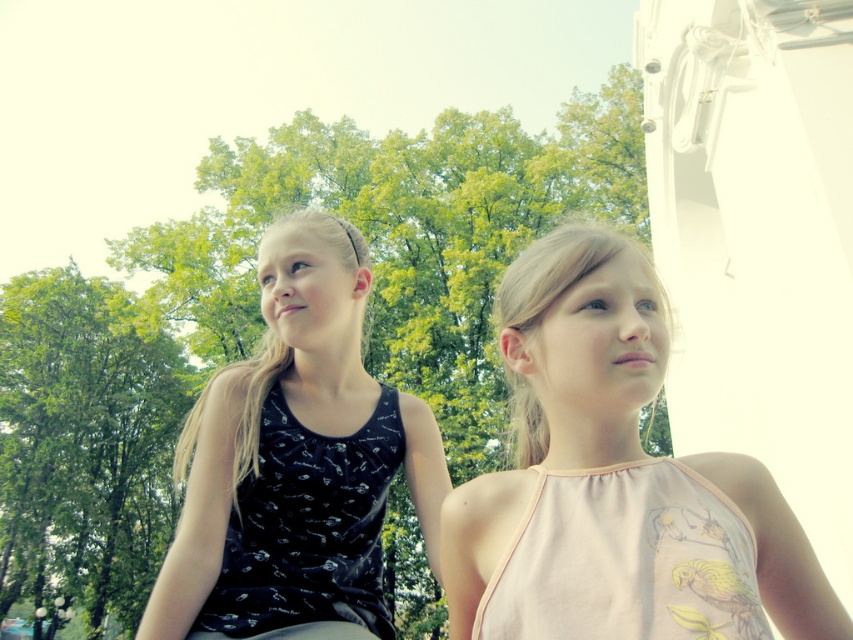
Can you confirm if black matte tank top at left is positioned above pink fabric dress at center?

Actually, black matte tank top at left is below pink fabric dress at center.

Describe the element at coordinates (296, 461) in the screenshot. This screenshot has height=640, width=853. I see `black matte tank top at left` at that location.

You are a GUI agent. You are given a task and a screenshot of the screen. Output one action in this format:
    pyautogui.click(x=<x>, y=<y>)
    Task: Click on the black matte tank top at left
    
    Given the screenshot: What is the action you would take?
    pyautogui.click(x=296, y=461)